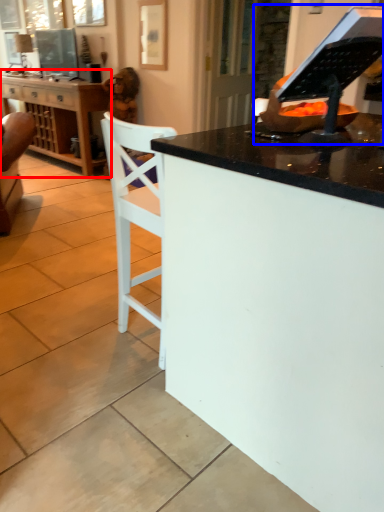
Question: Which object appears closest to the camera in this image, cabinetry (highlighted by a red box) or appliance (highlighted by a blue box)?

Choices:
 (A) cabinetry
 (B) appliance

Answer: (B)